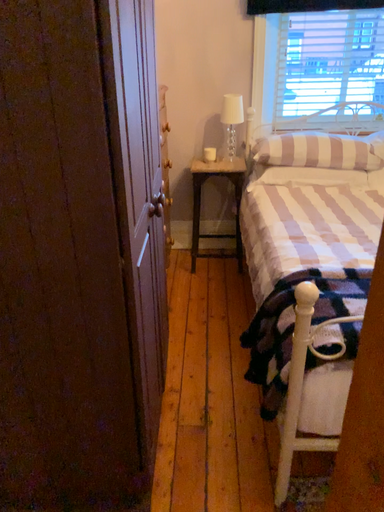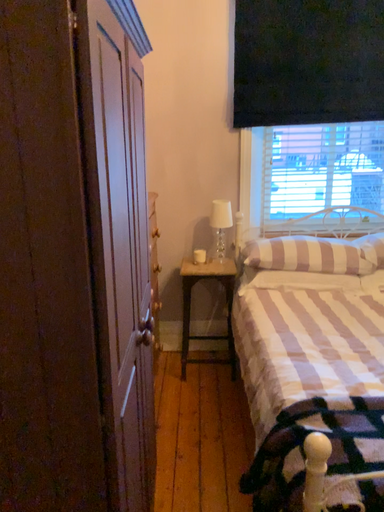
Question: Which way did the camera rotate in the video?

Choices:
 (A) rotated downward
 (B) rotated upward

Answer: (B)